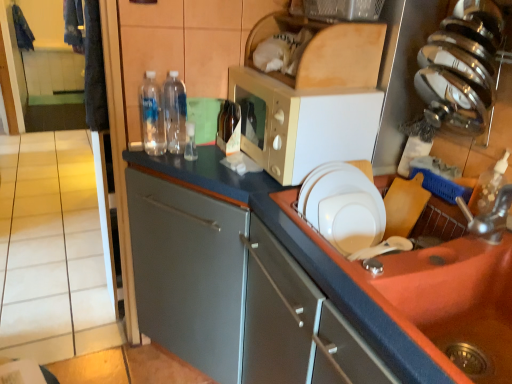
I want to click on vacant space that's between transparent plastic bottle at center, the 2th bottle viewed from the right, and brown glass bottle at center, which appears as the third bottle when viewed from the left, so click(x=202, y=150).